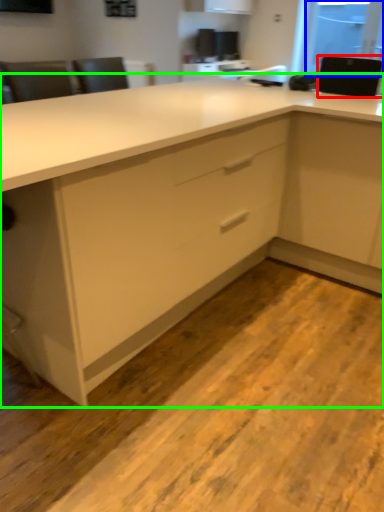
Question: Considering the real-world distances, which object is farthest from appliance (highlighted by a red box)? window screen (highlighted by a blue box) or cabinetry (highlighted by a green box)?

Choices:
 (A) window screen
 (B) cabinetry

Answer: (A)